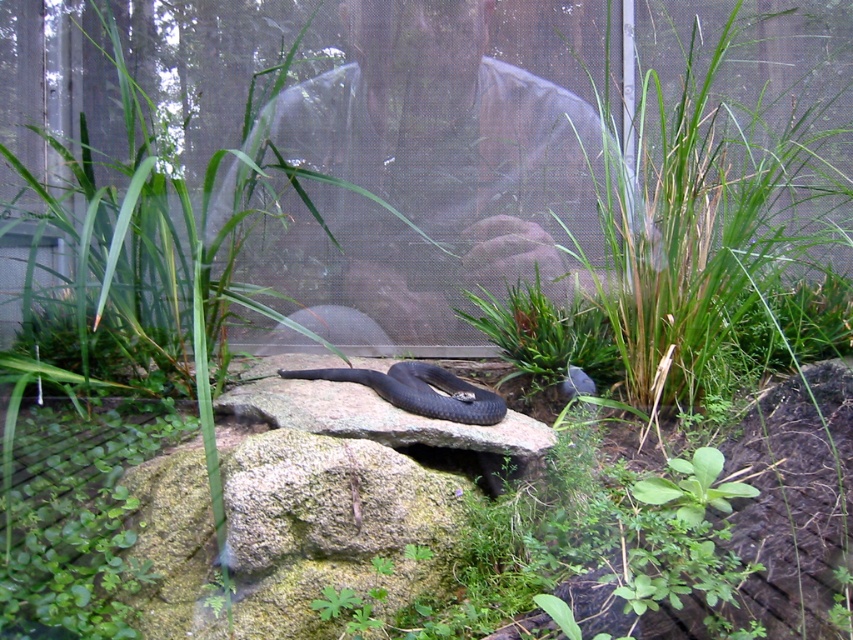
Can you confirm if green grass at center is bigger than shiny black snake at center?

Indeed, green grass at center has a larger size compared to shiny black snake at center.

Can you confirm if green grass at center is taller than shiny black snake at center?

Yes, green grass at center is taller than shiny black snake at center.

This screenshot has height=640, width=853. What are the coordinates of `green grass at center` in the screenshot? It's located at (705, 220).

Where is `green grass at center`? This screenshot has width=853, height=640. green grass at center is located at coordinates (705, 220).